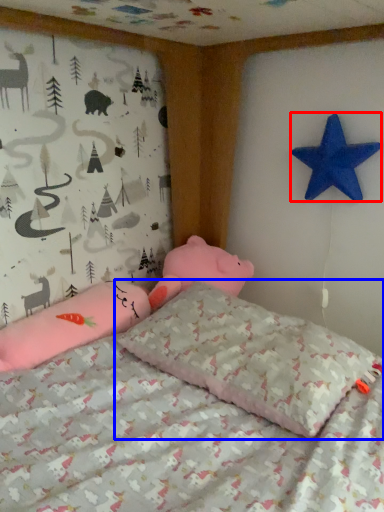
Question: Among these objects, which one is farthest to the camera, starfish (highlighted by a red box) or pillow (highlighted by a blue box)?

Choices:
 (A) starfish
 (B) pillow

Answer: (A)